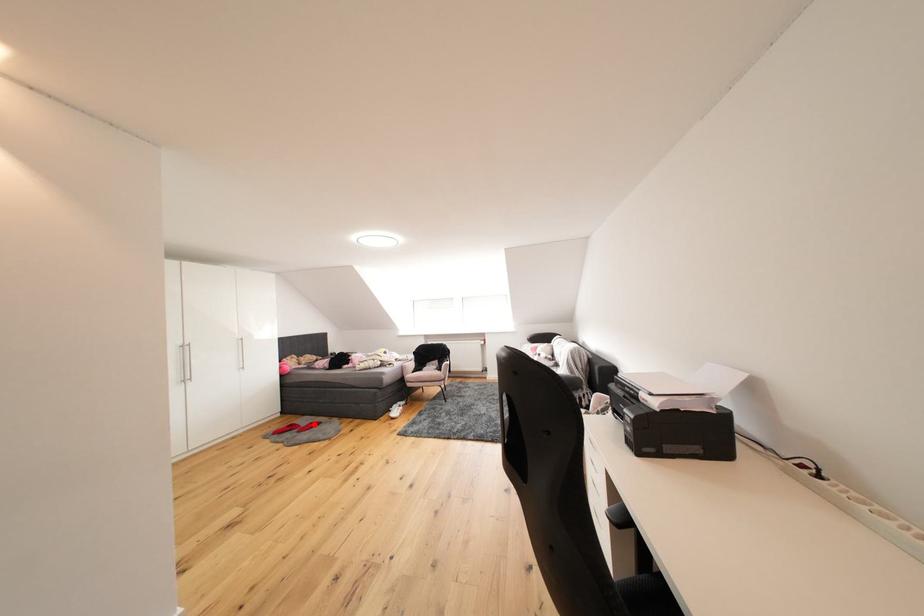
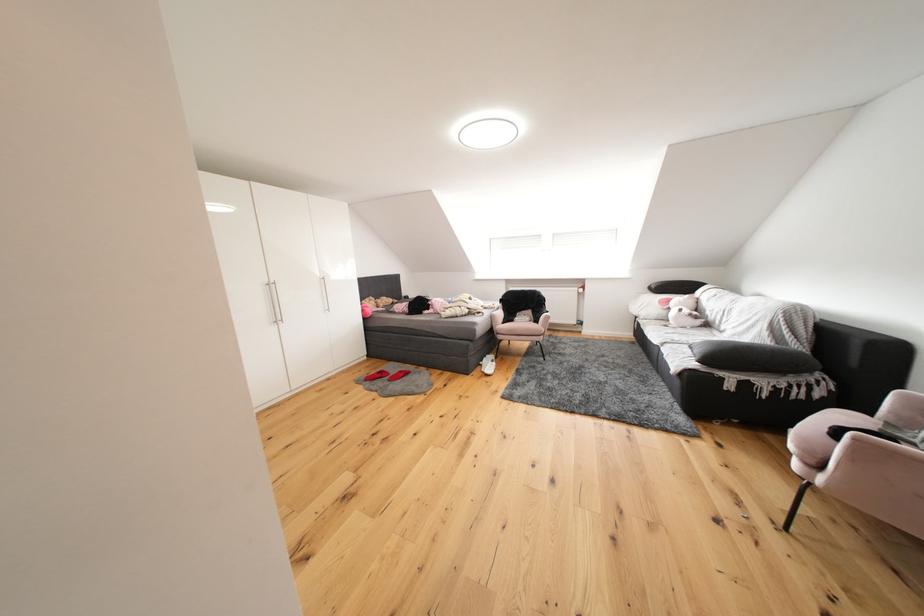
In the second image, find the point that corresponds to the highlighted location in the first image.

(402, 371)